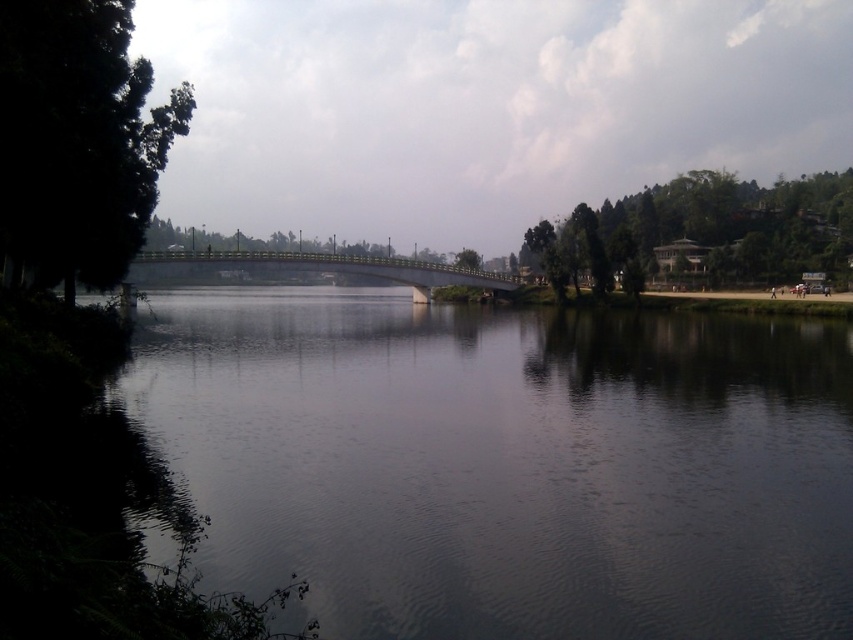
Question: Which point is closer to the camera taking this photo?

Choices:
 (A) (286, 429)
 (B) (474, 253)
 (C) (849, 234)

Answer: (A)

Question: Is green leafy tree at left positioned behind green metallic bridge at center?

Choices:
 (A) no
 (B) yes

Answer: (A)

Question: Does green metallic bridge at center appear on the right side of green leafy tree at center?

Choices:
 (A) yes
 (B) no

Answer: (B)

Question: Which point is farther to the camera?

Choices:
 (A) (627, 257)
 (B) (459, 250)

Answer: (B)

Question: Is green leafy trees at right below green metallic bridge at center?

Choices:
 (A) no
 (B) yes

Answer: (A)

Question: Which point is closer to the camera?

Choices:
 (A) green leafy tree at center
 (B) smooth dark water at center
 (C) green leafy trees at right

Answer: (B)